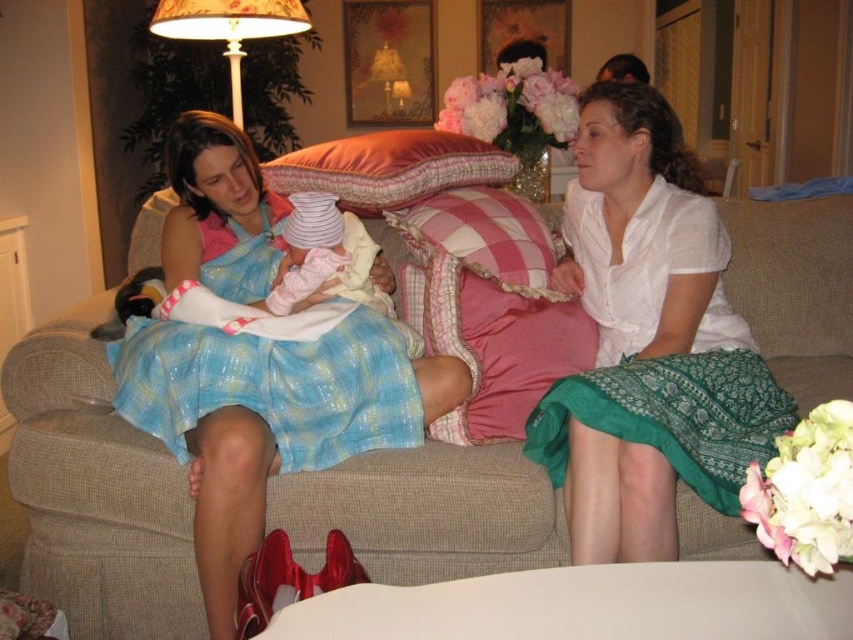
Question: Observing the image, what is the correct spatial positioning of white cotton shirt at center in reference to floral fabric lampshade at upper left?

Choices:
 (A) left
 (B) right

Answer: (B)

Question: Which of these objects is positioned closest to the blue plaid dress at center?

Choices:
 (A) white knit hat at center
 (B) blue plaid dress at left
 (C) beige fabric couch at center
 (D) pink velvety pillow at center

Answer: (B)

Question: Is beige fabric couch at center further to camera compared to blue plaid dress at left?

Choices:
 (A) no
 (B) yes

Answer: (B)

Question: Which object is farther from the camera taking this photo?

Choices:
 (A) pink velvety pillow at center
 (B) floral fabric lampshade at upper left
 (C) beige fabric couch at center
 (D) white cotton shirt at center

Answer: (B)

Question: Estimate the real-world distances between objects in this image. Which object is farther from the blue plaid dress at left?

Choices:
 (A) floral fabric lampshade at upper left
 (B) pink velvety pillow at center

Answer: (A)

Question: Can you confirm if pink velvety pillow at center is thinner than floral fabric lampshade at upper left?

Choices:
 (A) yes
 (B) no

Answer: (B)